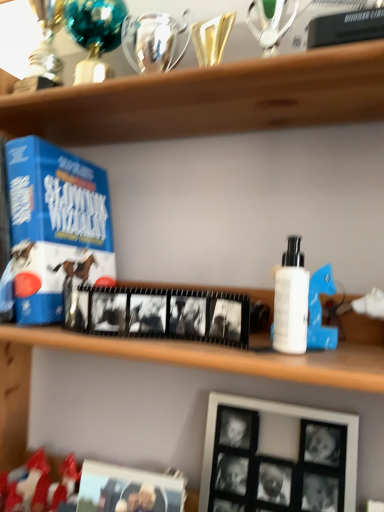
What do you see at coordinates (277, 457) in the screenshot?
I see `black matte picture frame at lower right, which is the 2th picture frame from left to right` at bounding box center [277, 457].

What do you see at coordinates (291, 301) in the screenshot?
I see `white matte bottle at right` at bounding box center [291, 301].

The width and height of the screenshot is (384, 512). Identify the location of black matte picture frame at lower center, the second picture frame viewed from the right. (129, 489).

This screenshot has height=512, width=384. Describe the element at coordinates (129, 489) in the screenshot. I see `black matte picture frame at lower center, the second picture frame viewed from the right` at that location.

Find the location of `black matte picture frame at lower right, which is counted as the first picture frame, starting from the right`. black matte picture frame at lower right, which is counted as the first picture frame, starting from the right is located at coordinates (277, 457).

Consider the image. Is blue cardboard game at left positioned in front of white matte bottle at right?

No, it is not.

Which point is more distant from viewer, (68, 271) or (302, 343)?

The point (68, 271) is farther.

I want to click on toiletry below the blue cardboard game at left (from the image's perspective), so click(291, 301).

Looking at this image, how far apart are blue cardboard game at left and white matte bottle at right?

blue cardboard game at left is 14.01 inches from white matte bottle at right.

From the blue cardboard game at left, count 2nd picture frame to the right and point to it. Please provide its 2D coordinates.

[(277, 457)]

Do you think black matte picture frame at lower right, which is the 2th picture frame from left to right, is within blue cardboard game at left, or outside of it?

black matte picture frame at lower right, which is the 2th picture frame from left to right, is not inside blue cardboard game at left, it's outside.

Is black matte picture frame at lower right, which is the 2th picture frame from left to right, directly adjacent to blue cardboard game at left?

No, black matte picture frame at lower right, which is the 2th picture frame from left to right, is not beside blue cardboard game at left.

From a real-world perspective, between black matte picture frame at lower right, which is the 2th picture frame from left to right, and blue cardboard game at left, who is vertically lower?

In real-world perspective, black matte picture frame at lower right, which is the 2th picture frame from left to right, is lower.

Does white matte bottle at right turn towards black matte picture frame at lower right, which is the 2th picture frame from left to right?

No, white matte bottle at right is not facing towards black matte picture frame at lower right, which is the 2th picture frame from left to right.

Between white matte bottle at right and black matte picture frame at lower right, which is counted as the first picture frame, starting from the right, which one has smaller width?

white matte bottle at right.

The image size is (384, 512). Identify the location of toiletry that is in front of the black matte picture frame at lower right, which is the 2th picture frame from left to right. (291, 301).

Choose the correct answer: Is white matte bottle at right inside black matte picture frame at lower right, which is the 2th picture frame from left to right, or outside it?

white matte bottle at right exists outside the volume of black matte picture frame at lower right, which is the 2th picture frame from left to right.

In the scene shown: Which of these two, black matte picture frame at lower right, which is the 2th picture frame from left to right, or white matte bottle at right, is wider?

black matte picture frame at lower right, which is the 2th picture frame from left to right.

From a real-world perspective, is black matte picture frame at lower right, which is the 2th picture frame from left to right, under white matte bottle at right?

Indeed, from a real-world perspective, black matte picture frame at lower right, which is the 2th picture frame from left to right, is positioned beneath white matte bottle at right.

From the image's perspective, relative to white matte bottle at right, is black matte picture frame at lower right, which is counted as the first picture frame, starting from the right, above or below?

From the image's perspective, black matte picture frame at lower right, which is counted as the first picture frame, starting from the right, appears below white matte bottle at right.

Do you think black matte picture frame at lower right, which is counted as the first picture frame, starting from the right, is within white matte bottle at right, or outside of it?

black matte picture frame at lower right, which is counted as the first picture frame, starting from the right, lies outside white matte bottle at right.

Is point (105, 499) positioned before point (286, 332)?

That is False.

How far apart are black matte picture frame at lower center, the second picture frame viewed from the right, and white matte bottle at right?

A distance of 11.46 inches exists between black matte picture frame at lower center, the second picture frame viewed from the right, and white matte bottle at right.

Are black matte picture frame at lower center, which ranks as the first picture frame in left-to-right order, and white matte bottle at right far apart?

They are positioned close to each other.

Is black matte picture frame at lower center, which ranks as the first picture frame in left-to-right order, bigger than white matte bottle at right?

Yes, black matte picture frame at lower center, which ranks as the first picture frame in left-to-right order, is bigger than white matte bottle at right.

What's the angular difference between white matte bottle at right and black matte picture frame at lower center, which ranks as the first picture frame in left-to-right order,'s facing directions?

The facing directions of white matte bottle at right and black matte picture frame at lower center, which ranks as the first picture frame in left-to-right order, are 7.03 degrees apart.

Which object is positioned more to the right, white matte bottle at right or black matte picture frame at lower center, which ranks as the first picture frame in left-to-right order?

white matte bottle at right.

Which is behind, point (278, 313) or point (102, 479)?

Point (102, 479)

From the image's perspective, which is below, white matte bottle at right or black matte picture frame at lower center, which ranks as the first picture frame in left-to-right order?

black matte picture frame at lower center, which ranks as the first picture frame in left-to-right order, from the image's perspective.

From the picture: From the image's perspective, is blue cardboard game at left located above or below black matte picture frame at lower right, which is the 2th picture frame from left to right?

blue cardboard game at left is situated higher than black matte picture frame at lower right, which is the 2th picture frame from left to right, in the image.

Which object is further away from the camera taking this photo, blue cardboard game at left or black matte picture frame at lower right, which is the 2th picture frame from left to right?

Positioned behind is blue cardboard game at left.

Is point (66, 223) in front of point (334, 504)?

No, (66, 223) is behind (334, 504).

Locate an element on the screen. product above the white matte bottle at right (from the image's perspective) is located at coordinates (56, 226).

From a real-world perspective, count 1st picture frames downward from the blue cardboard game at left and point to it. Please provide its 2D coordinates.

[(277, 457)]

Based on their spatial positions, is black matte picture frame at lower center, the second picture frame viewed from the right, or blue cardboard game at left closer to white matte bottle at right?

black matte picture frame at lower center, the second picture frame viewed from the right, is closer to white matte bottle at right.

Looking at the image, which one is located closer to blue cardboard game at left, black matte picture frame at lower right, which is counted as the first picture frame, starting from the right, or black matte picture frame at lower center, which ranks as the first picture frame in left-to-right order?

black matte picture frame at lower center, which ranks as the first picture frame in left-to-right order, is closer to blue cardboard game at left.

From the image, which object appears to be farther from white matte bottle at right, black matte picture frame at lower right, which is counted as the first picture frame, starting from the right, or blue cardboard game at left?

blue cardboard game at left is further to white matte bottle at right.

Based on their spatial positions, is white matte bottle at right or black matte picture frame at lower center, the second picture frame viewed from the right, further from black matte picture frame at lower right, which is the 2th picture frame from left to right?

Based on the image, white matte bottle at right appears to be further to black matte picture frame at lower right, which is the 2th picture frame from left to right.

Considering their positions, is white matte bottle at right positioned closer to blue cardboard game at left than black matte picture frame at lower center, which ranks as the first picture frame in left-to-right order?

The object closer to blue cardboard game at left is black matte picture frame at lower center, which ranks as the first picture frame in left-to-right order.

When comparing their distances from white matte bottle at right, does black matte picture frame at lower center, which ranks as the first picture frame in left-to-right order, or black matte picture frame at lower right, which is counted as the first picture frame, starting from the right, seem closer?

black matte picture frame at lower right, which is counted as the first picture frame, starting from the right, is closer to white matte bottle at right.

Looking at the image, which one is located closer to black matte picture frame at lower right, which is counted as the first picture frame, starting from the right, blue cardboard game at left or black matte picture frame at lower center, the second picture frame viewed from the right?

The object closer to black matte picture frame at lower right, which is counted as the first picture frame, starting from the right, is black matte picture frame at lower center, the second picture frame viewed from the right.

From the image, which object appears to be farther from black matte picture frame at lower right, which is counted as the first picture frame, starting from the right, blue cardboard game at left or white matte bottle at right?

Among the two, blue cardboard game at left is located further to black matte picture frame at lower right, which is counted as the first picture frame, starting from the right.

In order to click on picture frame that lies between white matte bottle at right and black matte picture frame at lower center, the second picture frame viewed from the right, from top to bottom in this screenshot , I will do `click(277, 457)`.

Where is `toiletry between blue cardboard game at left and black matte picture frame at lower center, which ranks as the first picture frame in left-to-right order, in the vertical direction`? The image size is (384, 512). toiletry between blue cardboard game at left and black matte picture frame at lower center, which ranks as the first picture frame in left-to-right order, in the vertical direction is located at coordinates (291, 301).

The image size is (384, 512). I want to click on toiletry located between blue cardboard game at left and black matte picture frame at lower right, which is counted as the first picture frame, starting from the right, in the left-right direction, so (291, 301).

Locate an element on the screen. picture frame between blue cardboard game at left and black matte picture frame at lower center, which ranks as the first picture frame in left-to-right order, vertically is located at coordinates (277, 457).